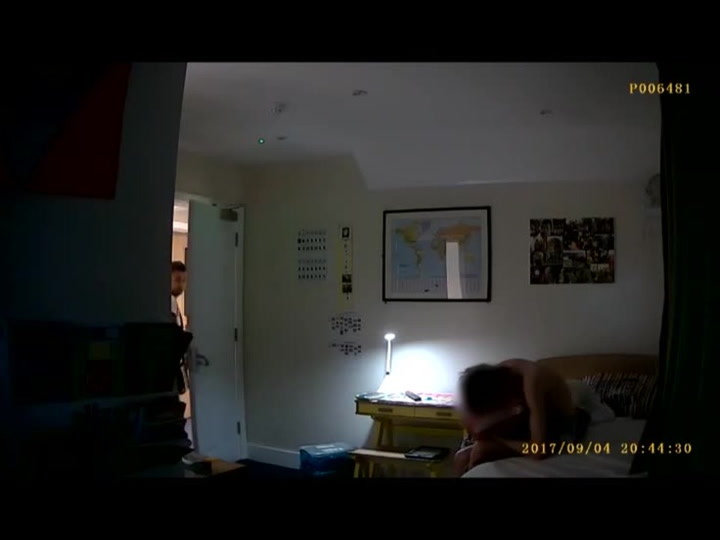
Image resolution: width=720 pixels, height=540 pixels. Find the location of `bed`. bed is located at coordinates (623, 426).